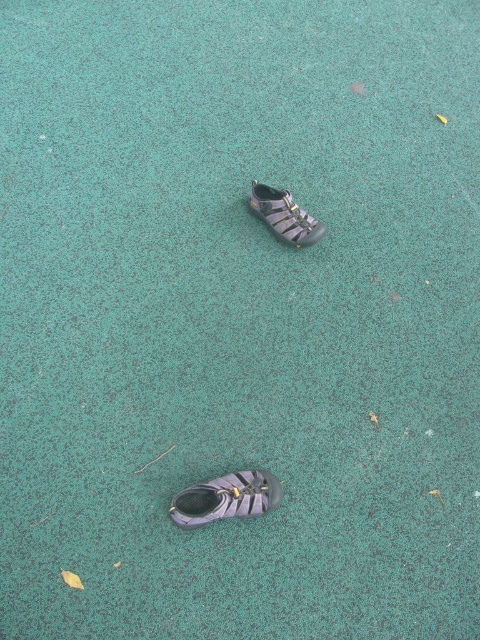
You are standing at the edge of the playground and see two points marked on the ground. The first point is at coordinates point [181,496] and the second is at point [268,188]. If you want to walk towards the point that is closer to you, which one should you choose?

Point [181,496] is in front of point [268,188], so you should choose point [181,496] as it is closer to you.

You are standing on the playground and want to pick up the purple fabric sandal at lower center. Which direction should you move relative to the black rubber sandal at center?

The purple fabric sandal at lower center is located below the black rubber sandal at center, so you should move downward from the black rubber sandal at center to reach it.

Consider the image. You are standing on the playground and want to pick up the closest sandal to you. Which one should you choose between the purple fabric sandal at lower center and the black rubber sandal at center?

The purple fabric sandal at lower center is closer to the viewer, so you should pick up the purple fabric sandal at lower center.